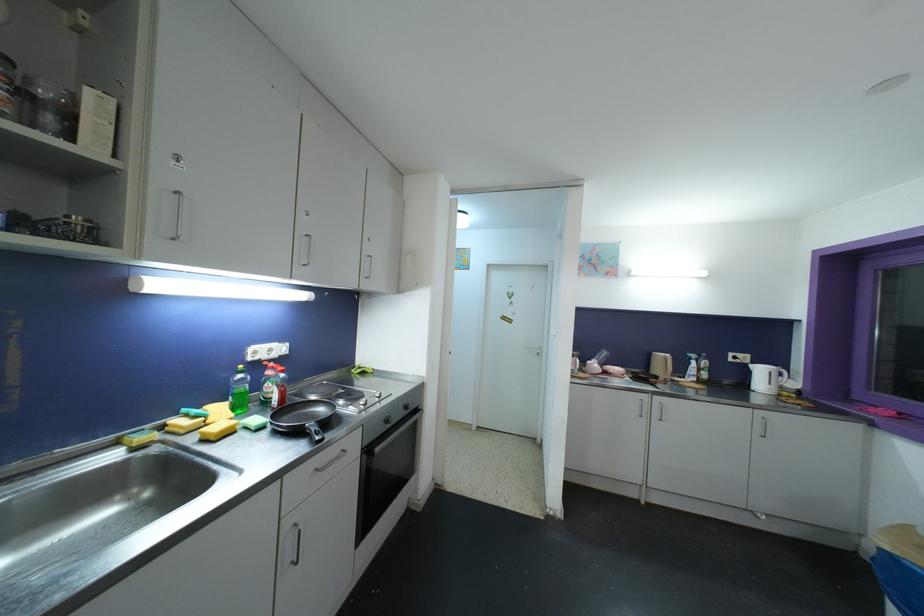
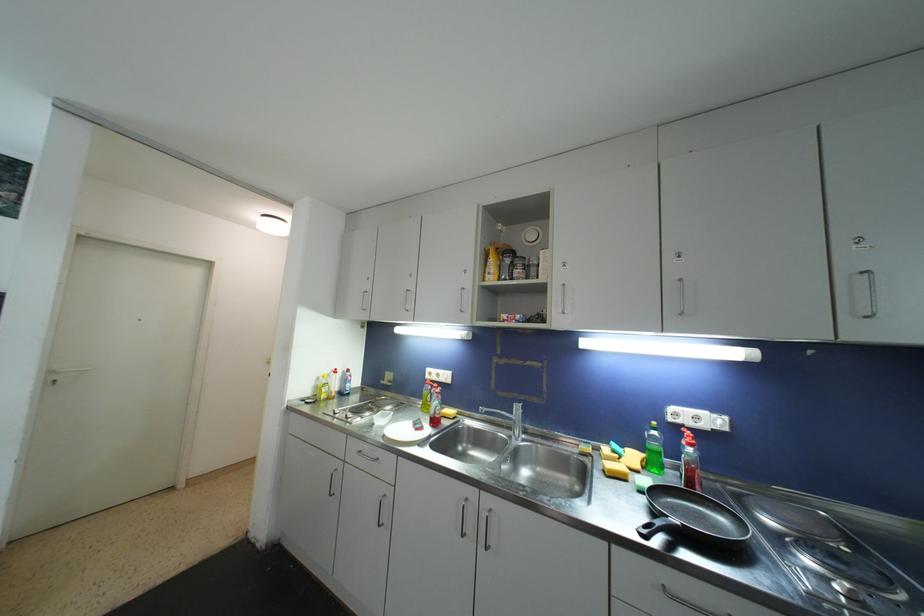
The point at [277,358] is marked in the first image. Where is the corresponding point in the second image?

(708, 429)